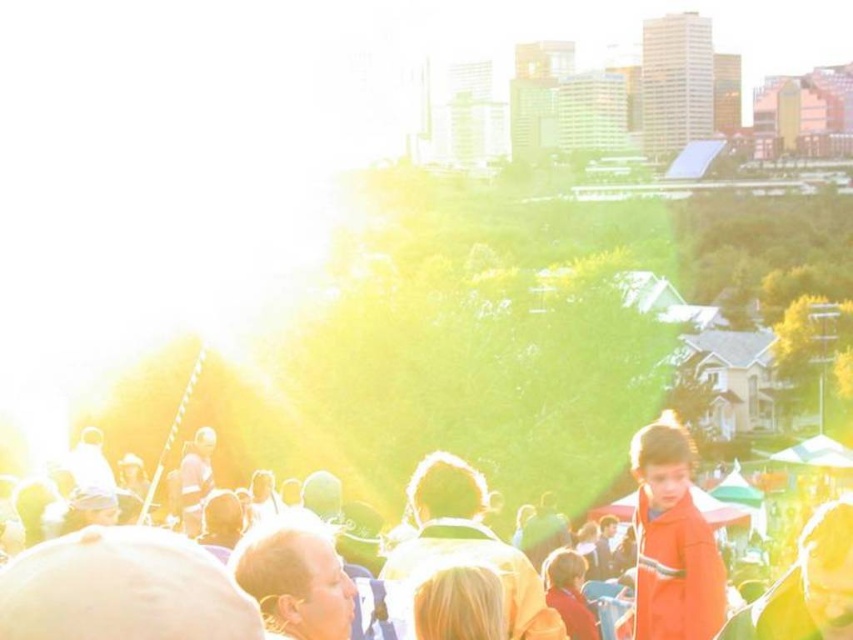
You are standing in the crowd and see the orange fabric at center and the orange matte coat at lower right. Which one is more to the left?

The orange fabric at center is more to the left because it is positioned on the left side of the orange matte coat at lower right.

You are standing in the crowd facing the main attraction. There are two points marked in the scene. One is at point [828,520] and the other at point [637,445]. Which point is closer to you?

Point [828,520] is in front of point [637,445], so it is closer to you.